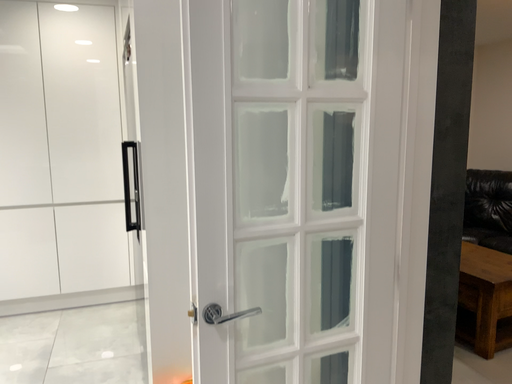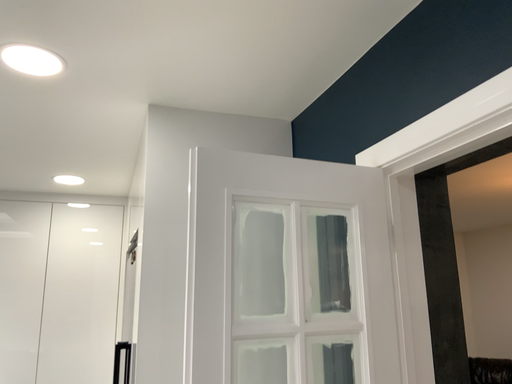
Question: How did the camera likely rotate when shooting the video?

Choices:
 (A) rotated upward
 (B) rotated downward

Answer: (A)